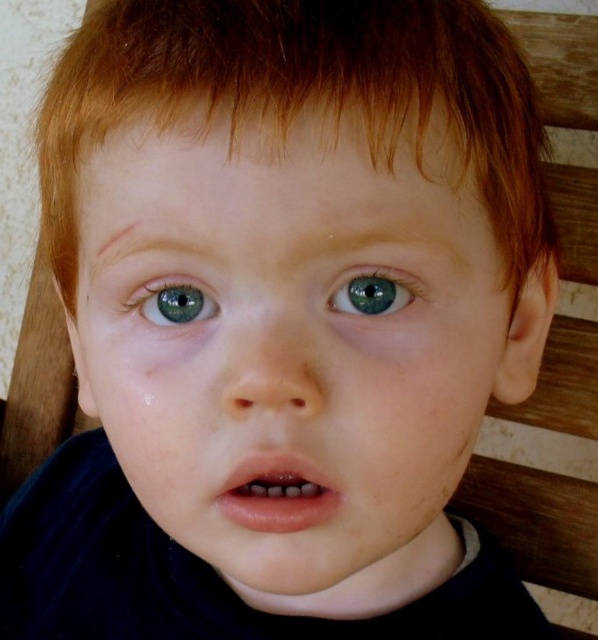
Question: Among these points, which one is farthest from the camera?

Choices:
 (A) (282, 13)
 (B) (388, 284)

Answer: (B)

Question: Which of the following is the farthest from the observer?

Choices:
 (A) blue glossy eye at center
 (B) blue glossy eye at upper left

Answer: (B)

Question: Is the position of reddish brown hair at upper center more distant than that of blue glossy eye at upper left?

Choices:
 (A) yes
 (B) no

Answer: (B)

Question: Does reddish brown hair at upper center have a greater width compared to blue glossy eye at upper left?

Choices:
 (A) yes
 (B) no

Answer: (A)

Question: Is the position of reddish brown hair at upper center more distant than that of blue glossy eye at center?

Choices:
 (A) no
 (B) yes

Answer: (A)

Question: Which object is the closest to the smooth skin face at center?

Choices:
 (A) reddish brown hair at upper center
 (B) blue glossy eye at center
 (C) blue glossy eye at upper left

Answer: (A)